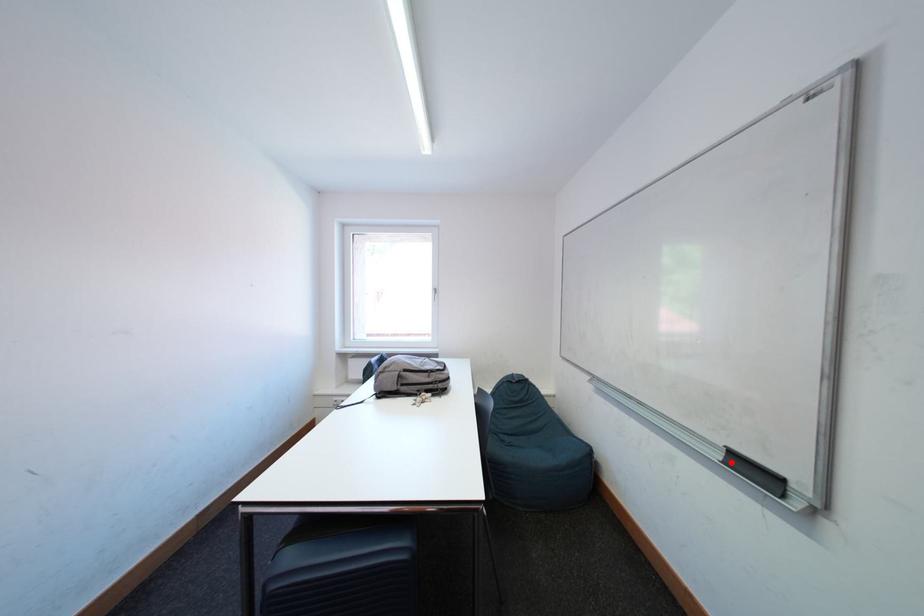
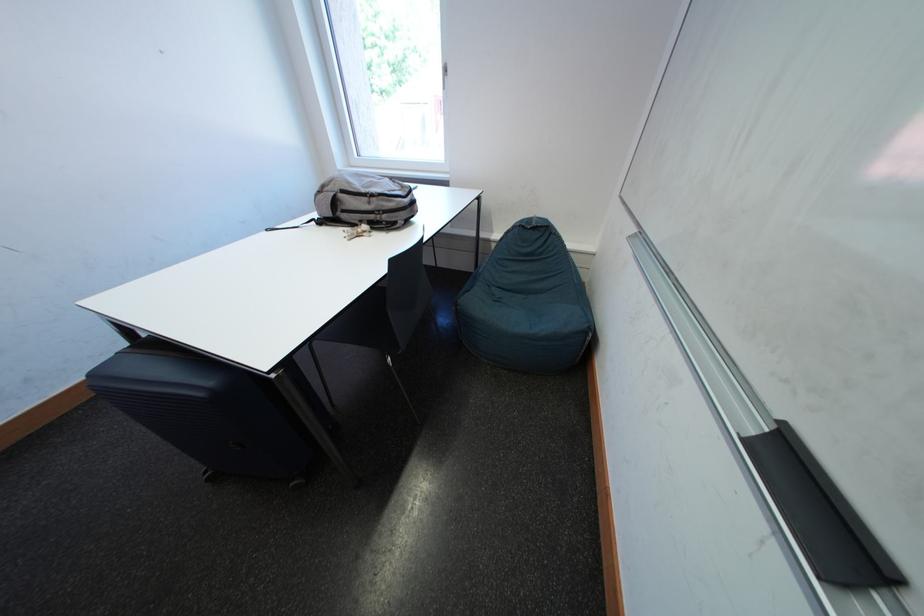
Question: I am providing you with two images of the same scene from different viewpoints. A red point is marked on the first image. At the location where the point appears in image 1, is it still visible in image 2?

Choices:
 (A) Yes
 (B) No

Answer: (A)